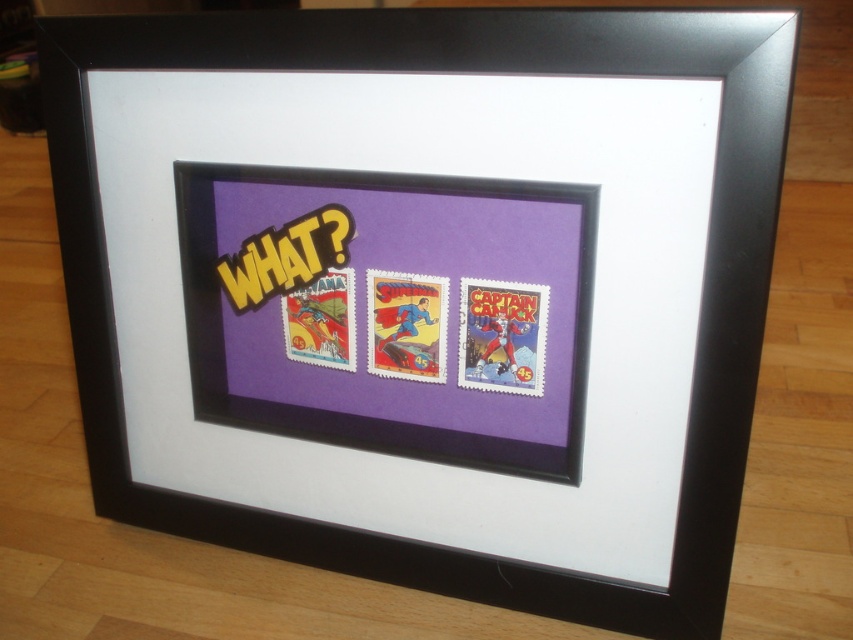
Between matte purple stamp at center and bright red paper stamp at center, which one is positioned lower?

matte purple stamp at center is lower down.

Is point (462, 280) farther from camera compared to point (432, 376)?

No.

Find the location of a particular element. matte purple stamp at center is located at coordinates (502, 336).